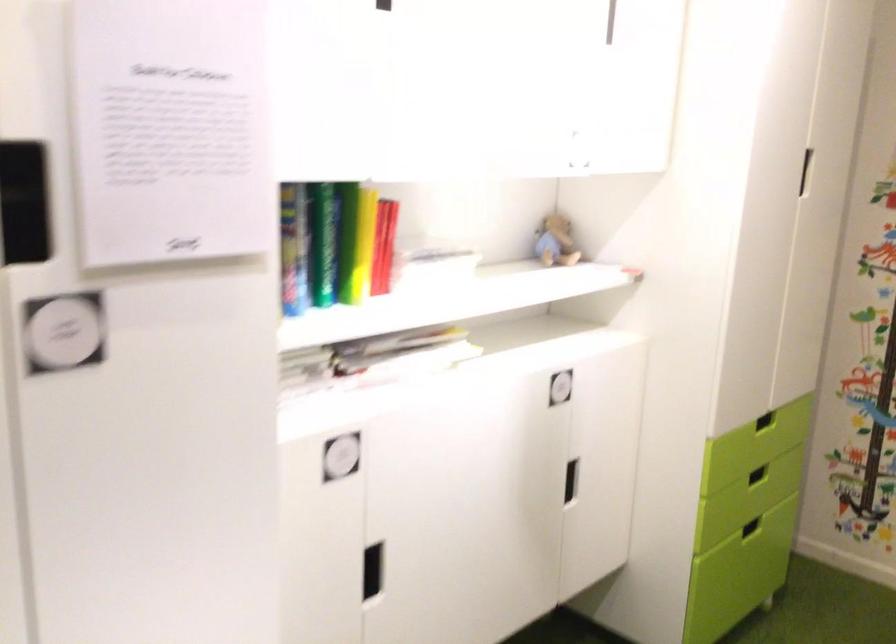
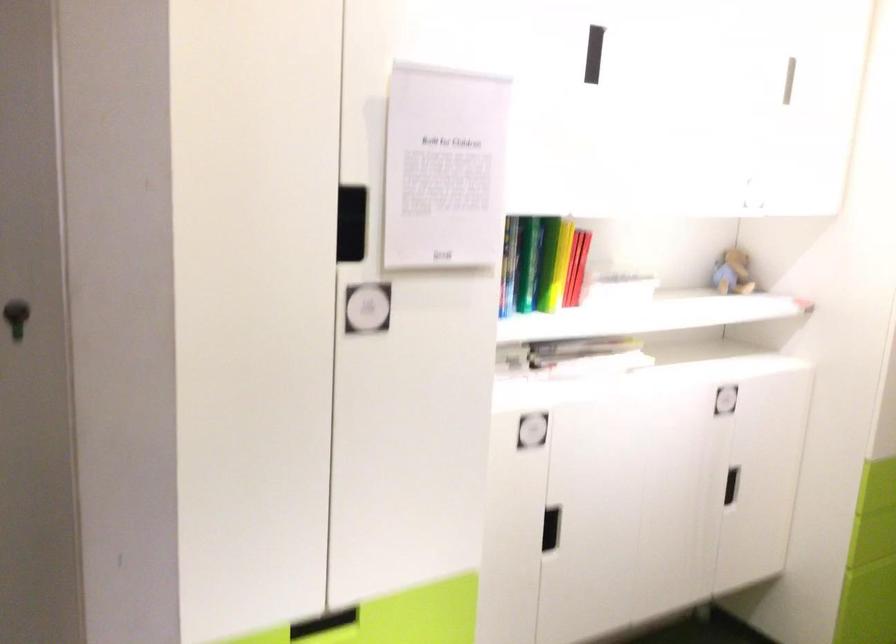
Locate, in the second image, the point that corresponds to (328,243) in the first image.

(528, 263)